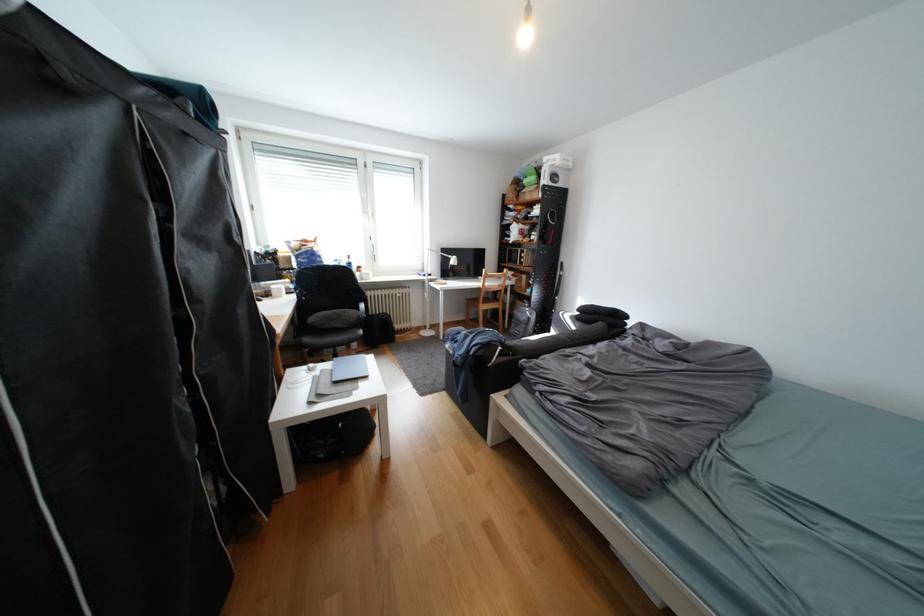
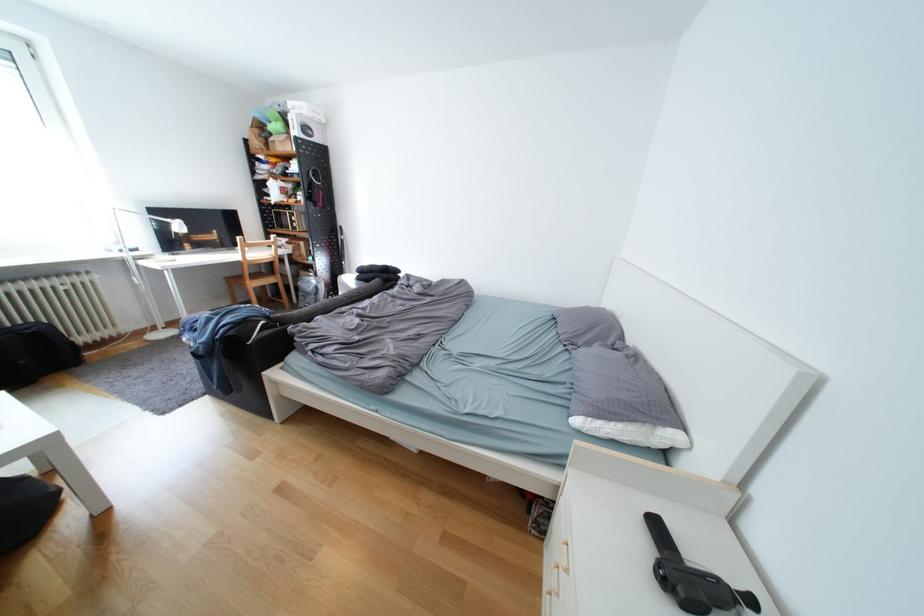
The point at (388, 315) is marked in the first image. Where is the corresponding point in the second image?

(14, 330)